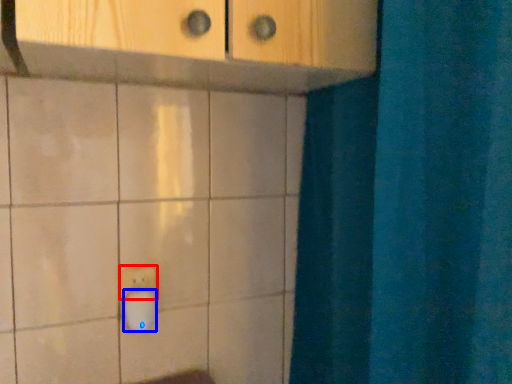
Question: Which point is further to the camera, light switch (highlighted by a red box) or knob (highlighted by a blue box)?

Choices:
 (A) light switch
 (B) knob

Answer: (A)